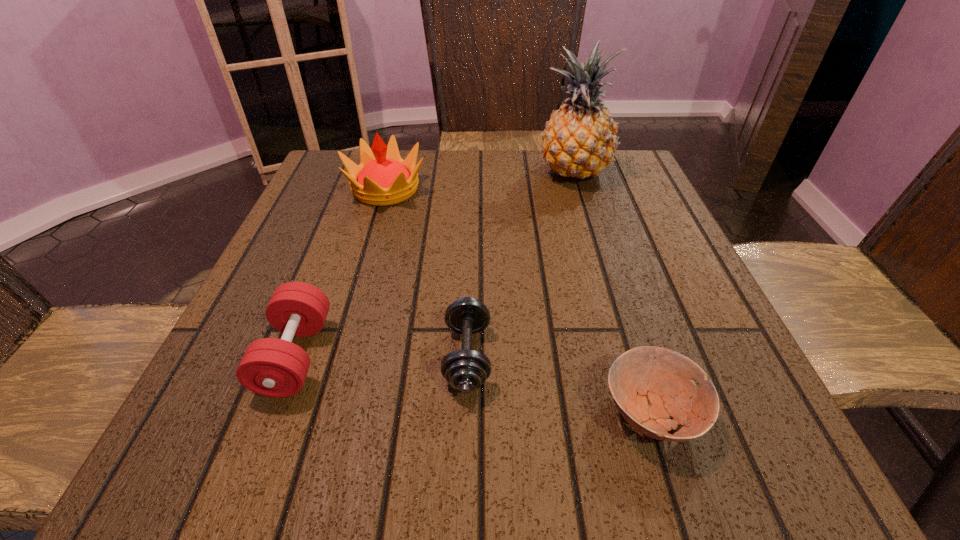
Find the location of `free location located 0.270m on the right of the right dumbbell`. free location located 0.270m on the right of the right dumbbell is located at coordinates (667, 356).

In order to click on free spot located 0.070m on the right of the bowl in this screenshot , I will do `click(752, 413)`.

The image size is (960, 540). Identify the location of pineapple located at the far edge. (579, 140).

You are a GUI agent. You are given a task and a screenshot of the screen. Output one action in this format:
    pyautogui.click(x=<x>, y=<y>)
    Task: Click on the crown present at the far edge
    This screenshot has width=960, height=540.
    Given the screenshot: What is the action you would take?
    pyautogui.click(x=383, y=178)

What are the coordinates of `object located at the near edge` in the screenshot? It's located at [649, 385].

You are a GUI agent. You are given a task and a screenshot of the screen. Output one action in this format:
    pyautogui.click(x=<x>, y=<y>)
    Task: Click on the crown at the left edge
    Image resolution: width=960 pixels, height=540 pixels.
    Given the screenshot: What is the action you would take?
    pyautogui.click(x=383, y=178)

This screenshot has height=540, width=960. In order to click on dumbbell that is at the left edge in this screenshot , I will do click(271, 367).

Locate an element on the screen. This screenshot has width=960, height=540. pineapple located at the right edge is located at coordinates (579, 140).

Identify the location of bowl situated at the right edge. (649, 385).

Locate an element on the screen. object that is at the far left corner is located at coordinates (383, 178).